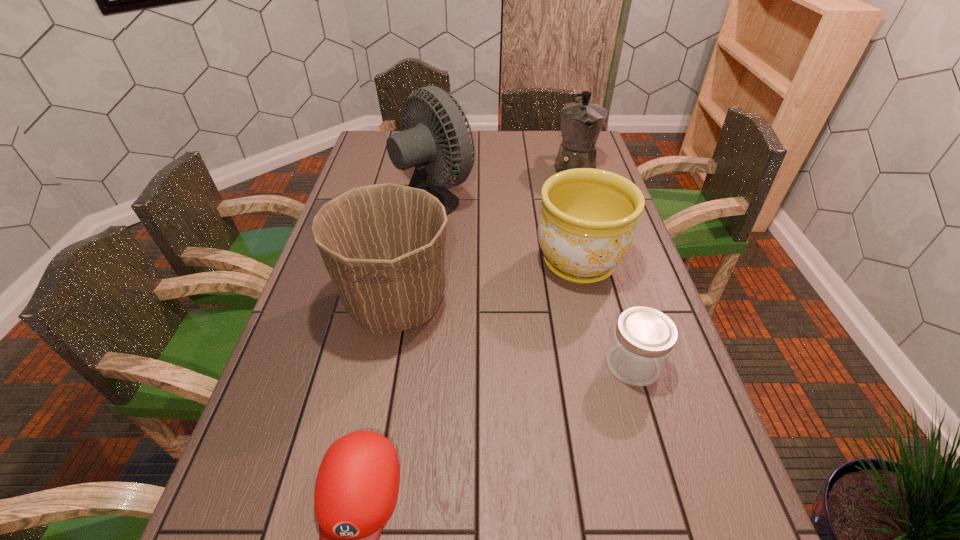
Find the location of a particular element. free space located on the right of the jar is located at coordinates (682, 364).

Identify the location of object located in the far edge section of the desktop. The image size is (960, 540). (581, 122).

This screenshot has width=960, height=540. I want to click on fan that is positioned at the left edge, so click(x=418, y=146).

Where is `flowerpot situated at the left edge`? Image resolution: width=960 pixels, height=540 pixels. flowerpot situated at the left edge is located at coordinates (383, 245).

Locate an element on the screen. The image size is (960, 540). coffeepot that is at the right edge is located at coordinates (581, 122).

Identify the location of flowerpot that is positioned at the right edge. (587, 224).

In order to click on jar at the right edge in this screenshot , I will do `click(643, 339)`.

At what (x,y) coordinates should I click in order to perform the action: click on object located in the far right corner section of the desktop. Please return your answer as a coordinate pair (x, y). Looking at the image, I should click on (581, 122).

Locate an element on the screen. The image size is (960, 540). free spot at the far edge of the desktop is located at coordinates (515, 144).

This screenshot has height=540, width=960. I want to click on vacant area at the left edge, so click(x=347, y=185).